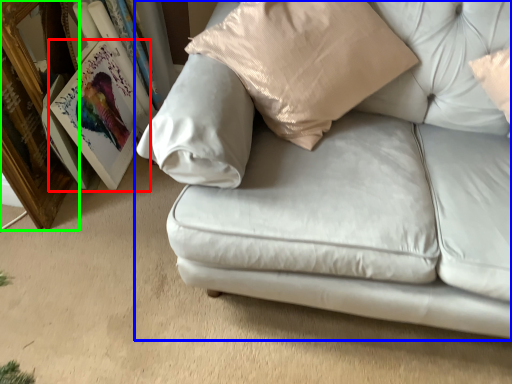
Question: Which object is positioned farthest from picture frame (highlighted by a red box)? Select from studio couch (highlighted by a blue box) and picture frame (highlighted by a green box).

Choices:
 (A) studio couch
 (B) picture frame

Answer: (A)